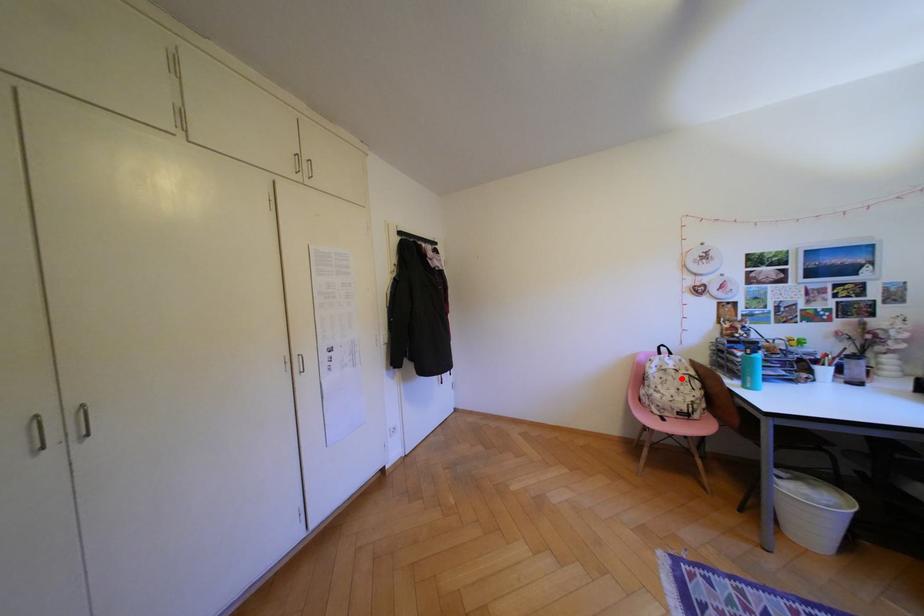
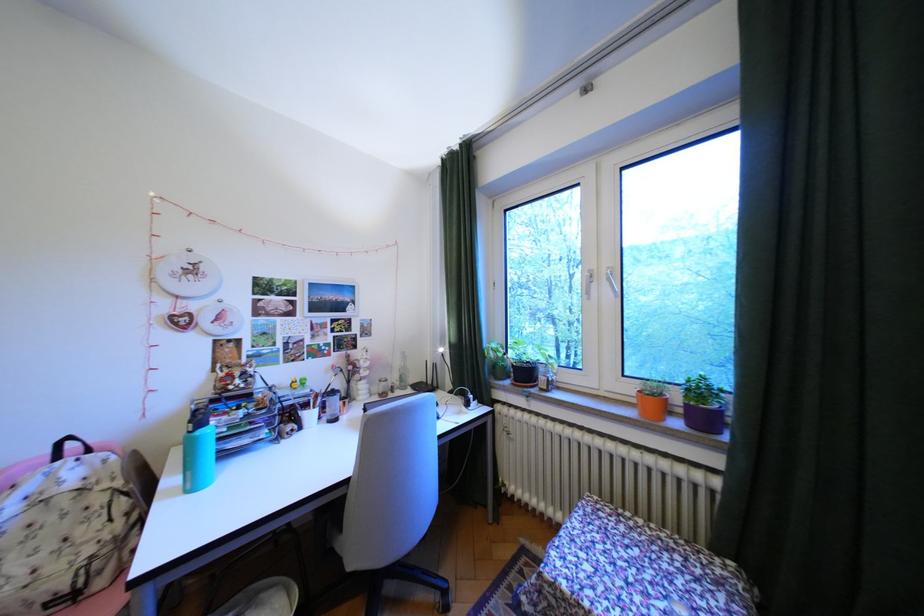
Question: I am providing you with two images of the same scene from different viewpoints. Image1 has a red point marked. In image2, the corresponding 3D location appears at what relative position? Reply with the corresponding letter.

Choices:
 (A) Closer
 (B) Farther

Answer: (A)